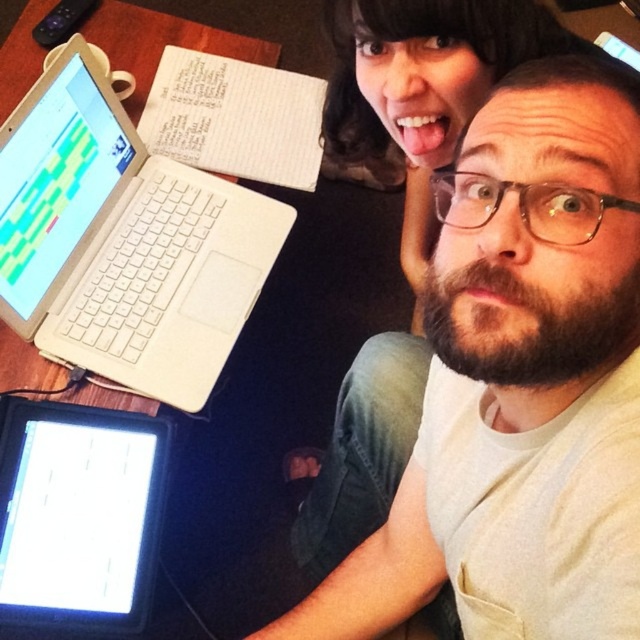
From the picture: Which of these two, wooden table at upper left or black glossy tablet at lower left, stands taller?

Standing taller between the two is wooden table at upper left.

Can you confirm if wooden table at upper left is positioned above black glossy tablet at lower left?

Yes, wooden table at upper left is above black glossy tablet at lower left.

The image size is (640, 640). Describe the element at coordinates (280, 401) in the screenshot. I see `wooden table at upper left` at that location.

What are the coordinates of `wooden table at upper left` in the screenshot? It's located at (280, 401).

Looking at this image, can you confirm if white plastic laptop at upper left is bigger than black glossy tablet at lower left?

Yes.

Does white plastic laptop at upper left have a lesser width compared to black glossy tablet at lower left?

No.

You are a GUI agent. You are given a task and a screenshot of the screen. Output one action in this format:
    pyautogui.click(x=<x>, y=<y>)
    Task: Click on the white plastic laptop at upper left
    This screenshot has height=640, width=640.
    Given the screenshot: What is the action you would take?
    pyautogui.click(x=124, y=241)

Can you confirm if white matte laptop at upper left is shorter than white plastic laptop at upper left?

In fact, white matte laptop at upper left may be taller than white plastic laptop at upper left.

Does white matte laptop at upper left have a larger size compared to white plastic laptop at upper left?

Yes.

At what (x,y) coordinates should I click in order to perform the action: click on white matte laptop at upper left. Please return your answer as a coordinate pair (x, y). The image size is (640, 640). Looking at the image, I should click on (499, 394).